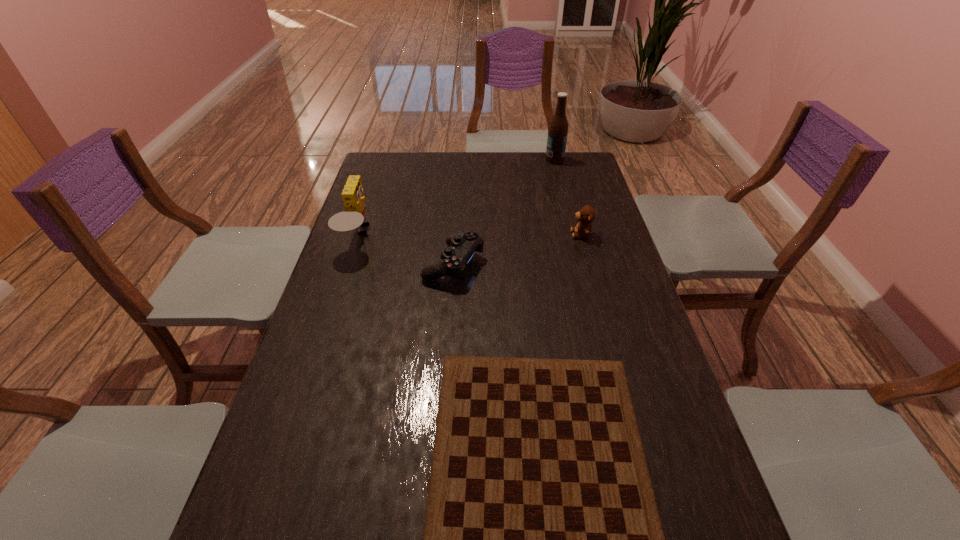
I want to click on free space located 0.160m on the face of the third shortest object, so click(x=522, y=234).

I want to click on blank space located 0.060m on the back of the control, so click(x=456, y=231).

Identify the location of object that is positioned at the far edge. This screenshot has width=960, height=540. (558, 129).

Locate an element on the screen. object that is at the left edge is located at coordinates 352,218.

This screenshot has height=540, width=960. I want to click on beer bottle located at the right edge, so click(x=558, y=129).

Where is `teddy bear that is positioned at the right edge`? The width and height of the screenshot is (960, 540). teddy bear that is positioned at the right edge is located at coordinates (586, 215).

Find the location of a particular element. object positioned at the far right corner is located at coordinates (558, 129).

The width and height of the screenshot is (960, 540). I want to click on blank space at the far edge of the desktop, so point(468,162).

Image resolution: width=960 pixels, height=540 pixels. I want to click on vacant space at the left edge, so click(314, 344).

This screenshot has width=960, height=540. What are the coordinates of `free spot at the right edge of the desktop` in the screenshot? It's located at (594, 186).